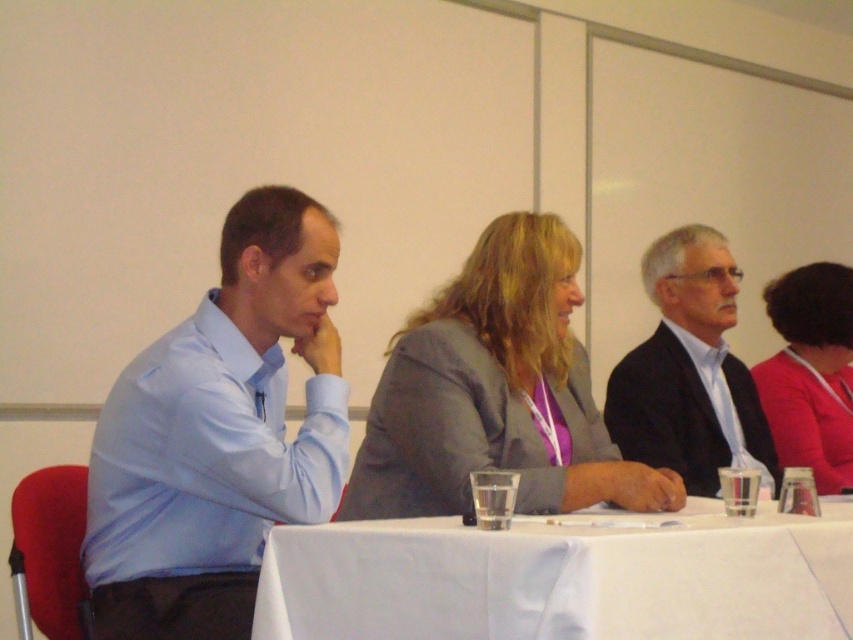
Question: Estimate the real-world distances between objects in this image. Which object is closer to the pink fabric jacket at right?

Choices:
 (A) dark gray suit at center
 (B) light blue shirt at left
 (C) white cloth at center
 (D) gray fabric jacket at center

Answer: (A)

Question: Estimate the real-world distances between objects in this image. Which object is farther from the dark gray suit at center?

Choices:
 (A) gray fabric jacket at center
 (B) white cloth at center
 (C) light blue shirt at left

Answer: (C)

Question: From the image, what is the correct spatial relationship of gray fabric jacket at center in relation to pink fabric jacket at right?

Choices:
 (A) above
 (B) below

Answer: (B)

Question: Is light blue shirt at left bigger than white cloth at center?

Choices:
 (A) no
 (B) yes

Answer: (B)

Question: Which object is the farthest from the light blue shirt at left?

Choices:
 (A) pink fabric jacket at right
 (B) gray fabric jacket at center

Answer: (A)

Question: Is dark gray suit at center to the right of pink fabric jacket at right from the viewer's perspective?

Choices:
 (A) no
 (B) yes

Answer: (A)